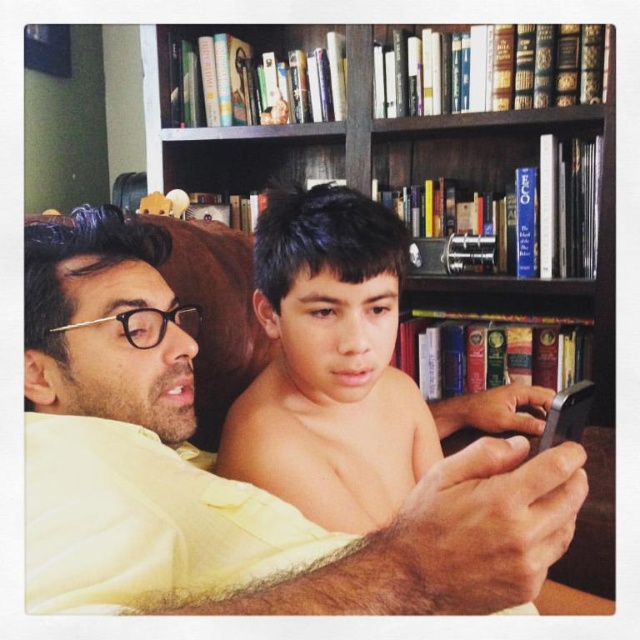
Question: Does matte yellow shirt at center lie in front of brown skin/smooth face at center?

Choices:
 (A) yes
 (B) no

Answer: (A)

Question: Which object appears closest to the camera in this image?

Choices:
 (A) brown skin/smooth face at center
 (B) wooden bookshelf at upper center

Answer: (A)

Question: Estimate the real-world distances between objects in this image. Which object is closer to the matte yellow shirt at center?

Choices:
 (A) brown skin/smooth face at center
 (B) wooden bookshelf at upper center

Answer: (A)

Question: Is matte yellow shirt at center smaller than brown skin/smooth face at center?

Choices:
 (A) yes
 (B) no

Answer: (B)

Question: Does matte yellow shirt at center appear over brown skin/smooth face at center?

Choices:
 (A) yes
 (B) no

Answer: (B)

Question: Among these objects, which one is nearest to the camera?

Choices:
 (A) wooden bookshelf at upper center
 (B) matte yellow shirt at center

Answer: (B)